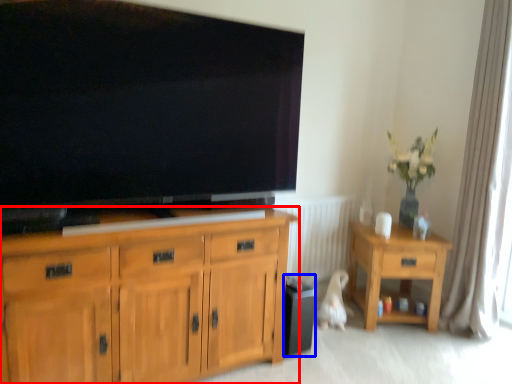
Question: Which object appears farthest to the camera in this image, cabinetry (highlighted by a red box) or loudspeaker (highlighted by a blue box)?

Choices:
 (A) cabinetry
 (B) loudspeaker

Answer: (B)